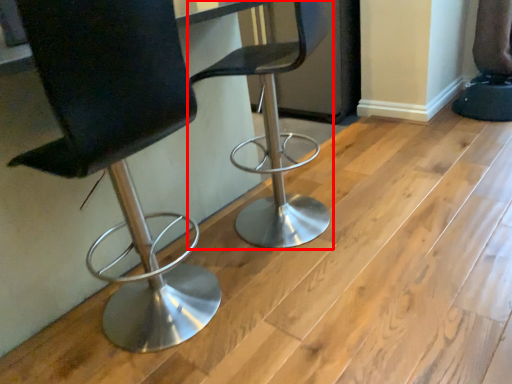
Question: From the image's perspective, considering the relative positions of chair (annotated by the red box) and chair in the image provided, where is chair (annotated by the red box) located with respect to the staircase?

Choices:
 (A) below
 (B) above

Answer: (B)